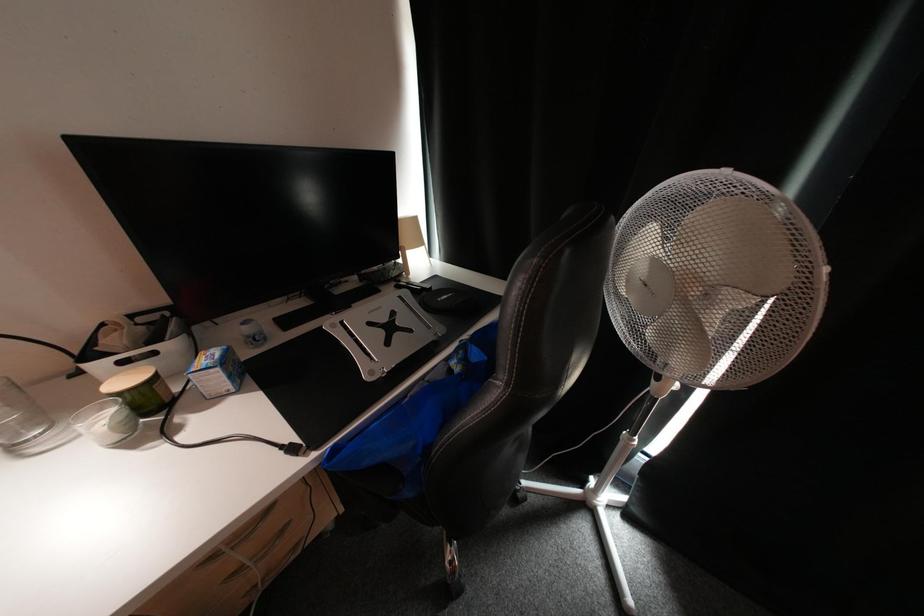
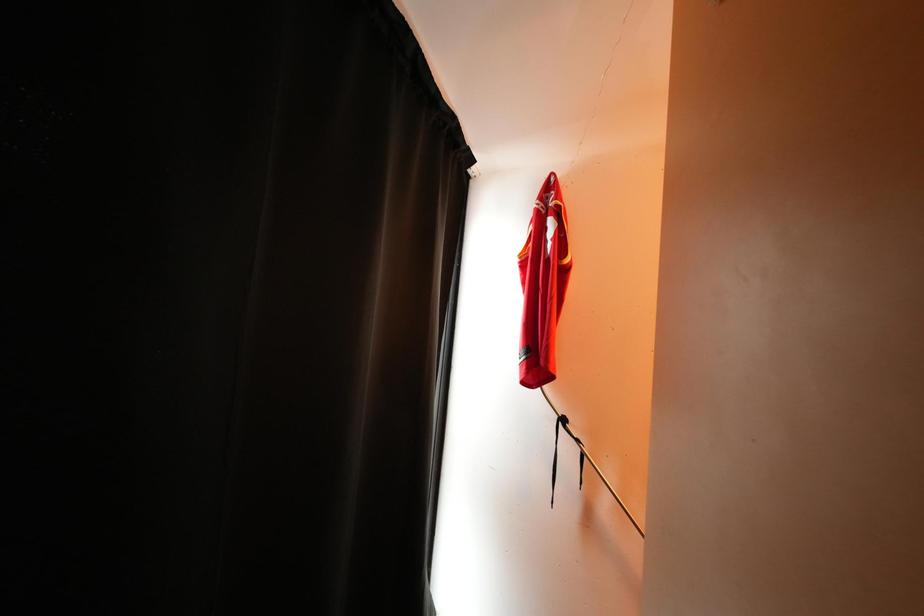
Question: The camera is either moving clockwise (left) or counter-clockwise (right) around the object. The first image is from the beginning of the video and the second image is from the end. Is the camera moving left or right when shooting the video?

Choices:
 (A) Left
 (B) Right

Answer: (A)